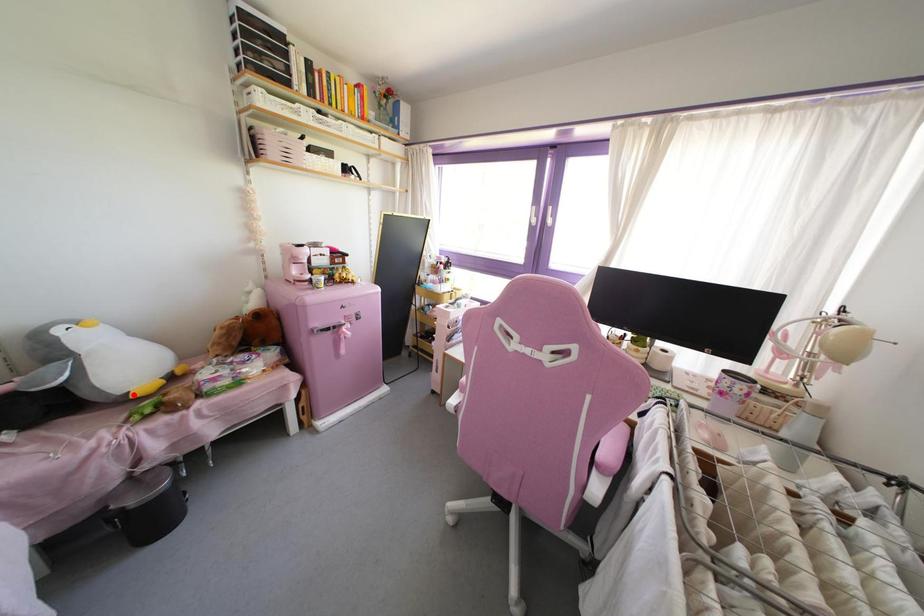
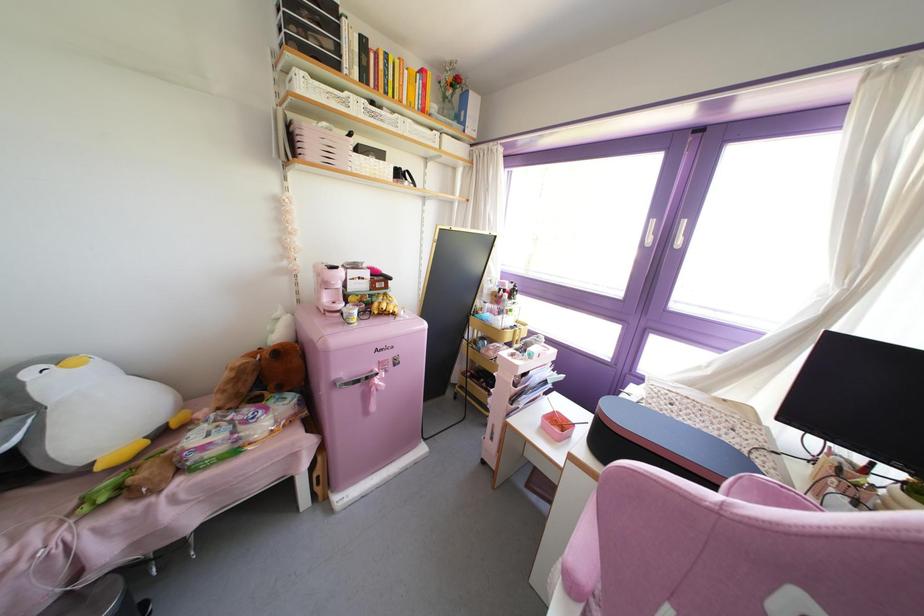
The point at the highlighted location is marked in the first image. Where is the corresponding point in the second image?

(99, 467)